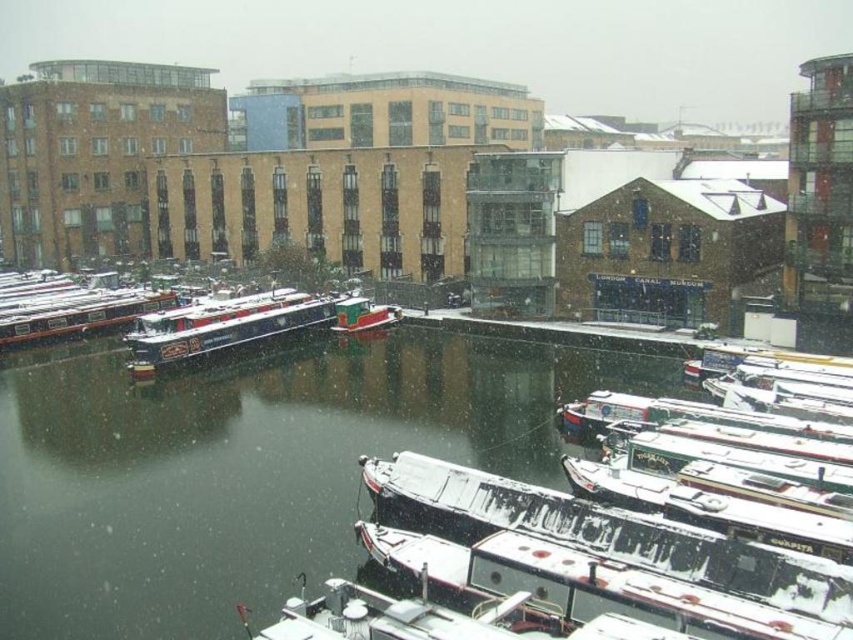
Question: Which of the following is the closest to the observer?

Choices:
 (A) (16, 301)
 (B) (340, 323)
 (C) (155, 321)

Answer: (C)

Question: Which point is closer to the camera?

Choices:
 (A) green matte canal boat at left
 (B) blue polished wood boat at center-left

Answer: (B)

Question: Can you confirm if white glossy boat at lower center is bigger than green matte canal boat at left?

Choices:
 (A) yes
 (B) no

Answer: (B)

Question: Based on their relative distances, which object is farther from the green matte canal boat at left?

Choices:
 (A) white glossy boat at lower right
 (B) green matte boat at center
 (C) white glossy boat at lower center
 (D) blue polished wood boat at center-left

Answer: (C)

Question: Does white glossy boat at lower right have a smaller size compared to green matte boat at center?

Choices:
 (A) no
 (B) yes

Answer: (A)

Question: Is white glossy boat at lower right to the right of blue polished wood boat at center-left from the viewer's perspective?

Choices:
 (A) no
 (B) yes

Answer: (B)